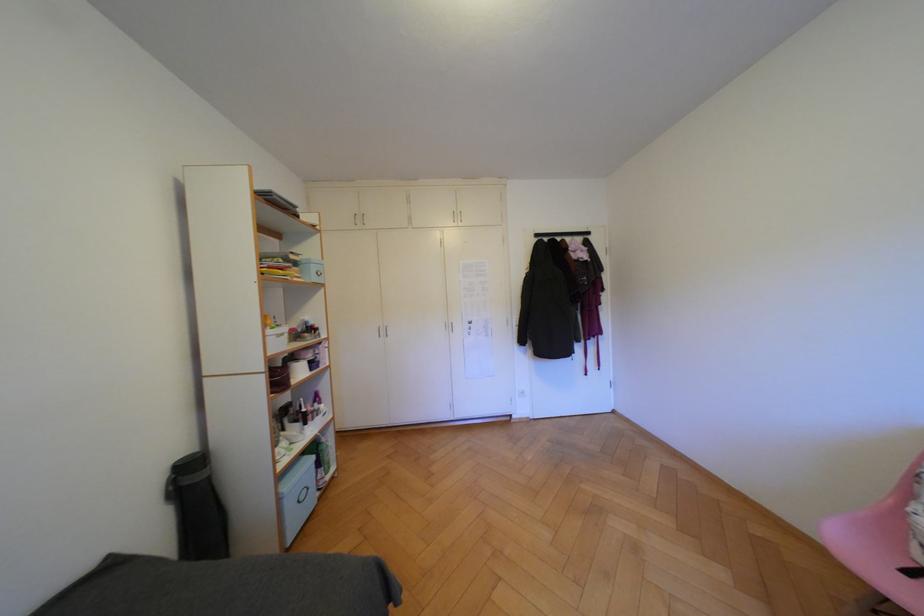
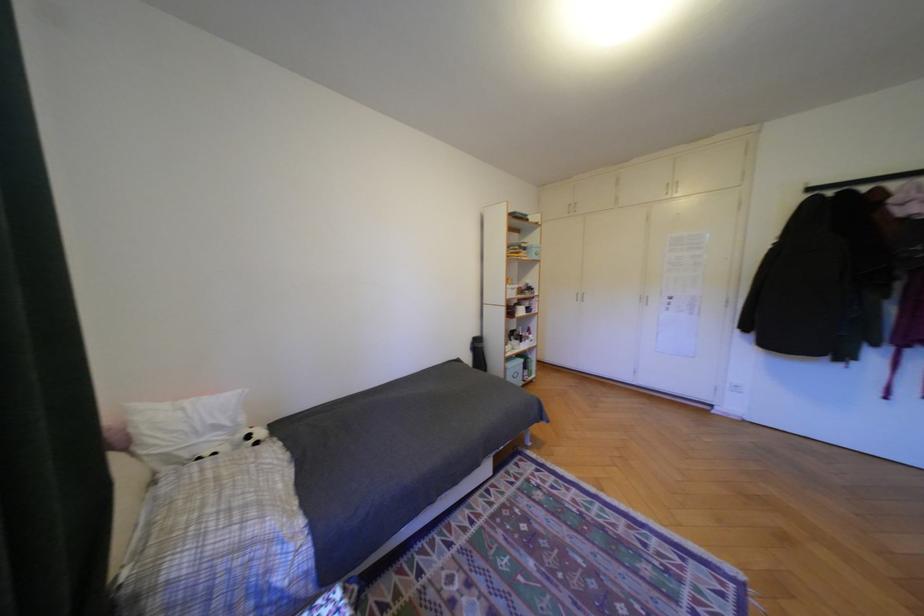
Question: The camera is either moving clockwise (left) or counter-clockwise (right) around the object. The first image is from the beginning of the video and the second image is from the end. Is the camera moving left or right when shooting the video?

Choices:
 (A) Left
 (B) Right

Answer: (B)